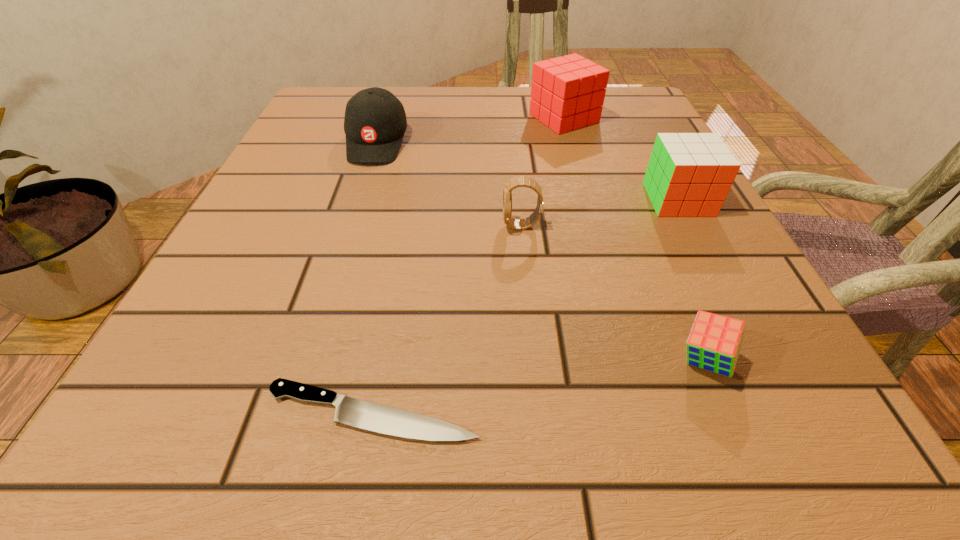
Identify the location of the farthest cube. Image resolution: width=960 pixels, height=540 pixels. (567, 93).

Where is `the second farthest cube`? the second farthest cube is located at coordinates (689, 174).

Identify the location of baseball cap. This screenshot has width=960, height=540. (375, 122).

Where is `the fourth object from right to left`? The width and height of the screenshot is (960, 540). the fourth object from right to left is located at coordinates (519, 181).

Identify the location of the fifth tallest object. (715, 341).

This screenshot has height=540, width=960. In order to click on the shortest cube in this screenshot , I will do `click(715, 341)`.

Locate an element on the screen. steak knife is located at coordinates click(349, 411).

Identify the location of vacant area situated on the left of the farthest cube. The height and width of the screenshot is (540, 960). (468, 118).

At what (x,y) coordinates should I click in order to perform the action: click on free location located 0.140m on the left of the second nearest cube. Please return your answer as a coordinate pair (x, y). The width and height of the screenshot is (960, 540). Looking at the image, I should click on (570, 199).

In order to click on blank space located with a logo on the front of the baseball cap in this screenshot , I will do `click(352, 219)`.